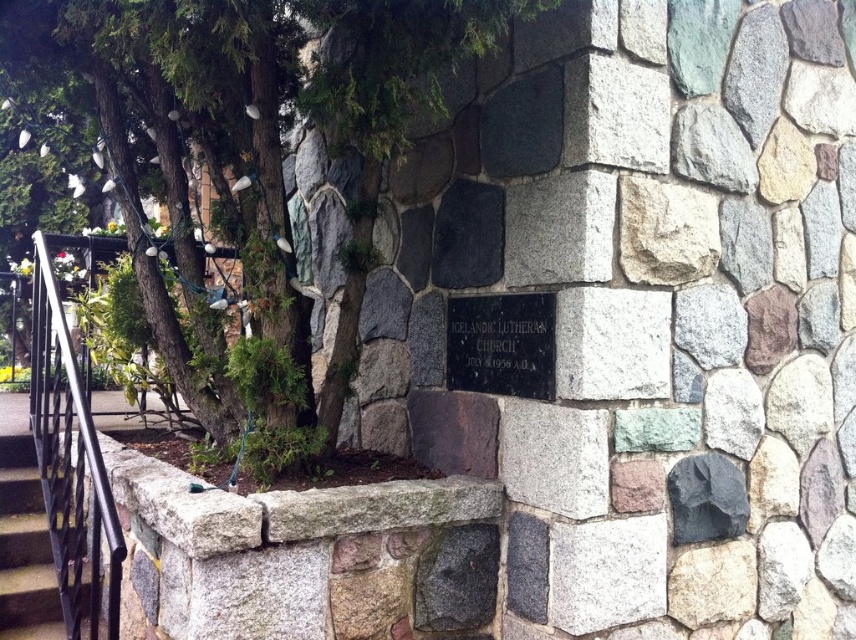
You are standing in front of the stone wall with the Icelandic Lutheran Church plaque. There is a green leafy tree at center. If you want to take a photo of the tree while ensuring the entire plaque is also visible in the frame, will you need to step back or move closer? Please explain your reasoning.

The green leafy tree at center is 1.70 meters away from the camera. To include both the tree and the plaque on the wall in the same frame, you should step back slightly to ensure both elements are within the camera view. Moving closer might cause the plaque to be cropped out of the frame.

You are standing on the black metal stairs at lower left and want to reach the black wrought iron railing at left. Which direction should you move to get there?

You should move upward because the black wrought iron railing at left is positioned over the black metal stairs at lower left, meaning it is above you.